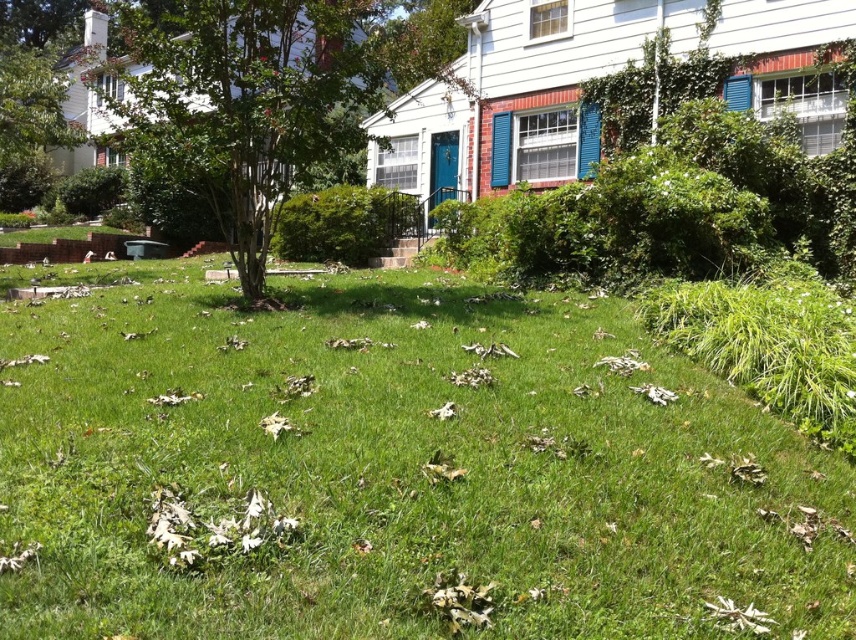
You are standing in the suburban residential scene described. You notice two points marked in the image. The first point is at coordinates point (824,589) and the second point is at point (467,1). Which of these two points is nearer to your current position?

Point (824,589) is closer to the viewer than point (467,1), so the first point is nearer to your current position.

You are standing in the suburban residential scene and want to walk from the green leafy tree at center to the green grass at center. Which direction should you move relative to the tree?

To move from the green leafy tree at center to the green grass at center, you should move to the right side of the tree since the grass is positioned on the right side of the tree.